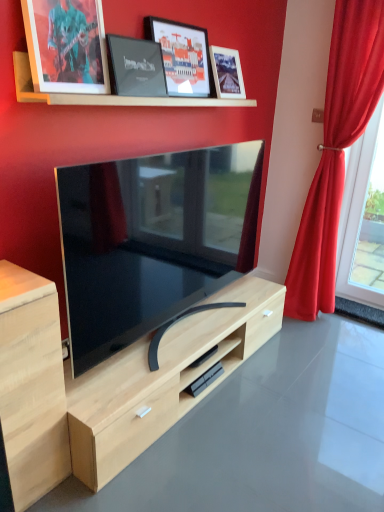
Question: Is light wood dresser at center taller or shorter than red velvet curtain at right?

Choices:
 (A) short
 (B) tall

Answer: (A)

Question: Considering the positions of light wood dresser at center and red velvet curtain at right in the image, is light wood dresser at center wider or thinner than red velvet curtain at right?

Choices:
 (A) thin
 (B) wide

Answer: (B)

Question: Considering the real-world distances, which object is closest to the red velvet curtain at right?

Choices:
 (A) matte black picture frame at upper left, arranged as the 4th picture frame when viewed from the right
 (B) wooden at upper center
 (C) light wood cabinet at left
 (D) matte black tv at center
 (E) matte glass picture frame at upper center, arranged as the third picture frame when viewed from the left

Answer: (B)

Question: Considering the real-world distances, which object is farthest from the red velvet curtain at right?

Choices:
 (A) matte black picture frame at upper center, arranged as the 2th picture frame when viewed from the left
 (B) light wood cabinet at left
 (C) glass window at right
 (D) matte black picture frame at upper left, arranged as the 4th picture frame when viewed from the right
 (E) matte black tv at center

Answer: (B)